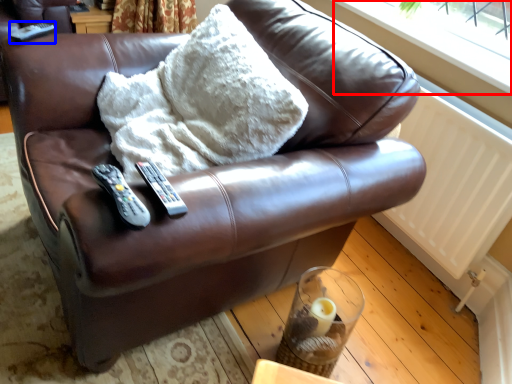
Question: Which object appears farthest to the camera in this image, window frame (highlighted by a red box) or remote (highlighted by a blue box)?

Choices:
 (A) window frame
 (B) remote

Answer: (B)